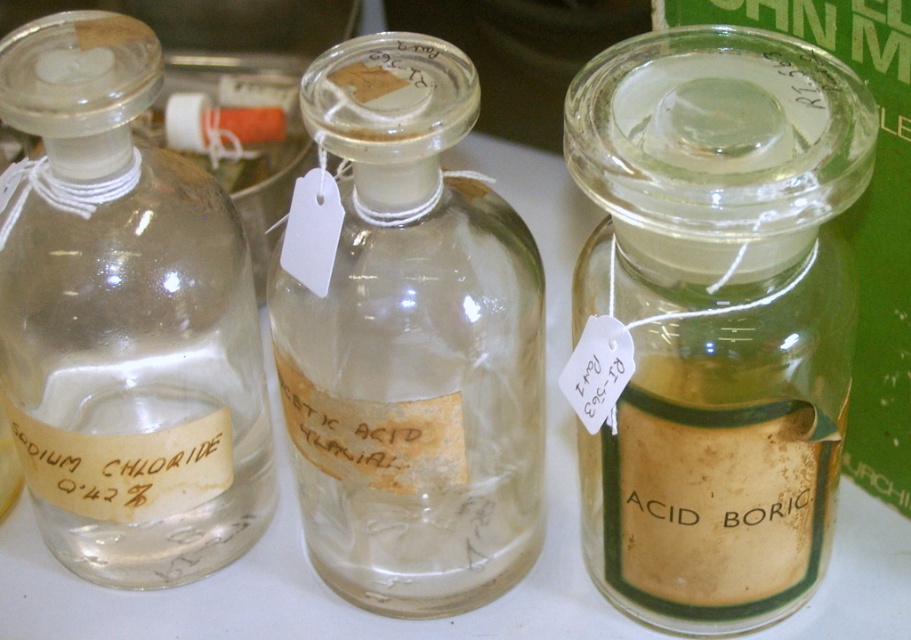
From the picture: You are organizing a chemistry lab and need to store these items on a shelf. The shelf has a height limit of 15 cm. You have the transparent glass jar at center and the transparent glass bottle at left. Which one can you place on the shelf without exceeding the height limit?

The transparent glass jar at center is shorter than the transparent glass bottle at left. Since the shelf has a height limit of 15 cm, the transparent glass jar at center can be placed on the shelf without exceeding the height limit, but the transparent glass bottle at left might be too tall depending on its exact height.

You are a lab technician who needs to place a 5.5 inch ruler between the transparent glass bottle at left and the transparent glass bottle at center. Is there enough space to fit the ruler horizontally between them?

The distance between the transparent glass bottle at left and the transparent glass bottle at center is 5.11 inches. Since the ruler is 5.5 inches long, it would not fit horizontally between them as the space is slightly narrower than the ruler.

You are a researcher organizing a lab. You need to move the transparent glass jar at center and the transparent glass bottle at center to a new shelf. The new shelf has a height limit of 10 cm. Can both items be placed on the shelf without exceeding the height limit?

The transparent glass jar at center is in front of the transparent glass bottle at center, but their individual heights are not provided. Without knowing their specific heights, it is impossible to determine if they can fit on the shelf with the 10 cm height limit.